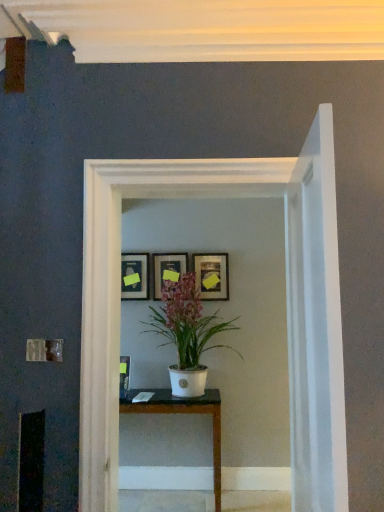
Question: Is matte gold picture frame at center, acting as the third picture frame starting from the left, wider or thinner than white glossy table at center?

Choices:
 (A) wide
 (B) thin

Answer: (B)

Question: From a real-world perspective, relative to white glossy table at center, is matte gold picture frame at center, the first picture frame viewed from the right, vertically above or below?

Choices:
 (A) below
 (B) above

Answer: (B)

Question: Which is farther from the matte black picture frame at upper center, positioned as the first picture frame in left-to-right order?

Choices:
 (A) white glossy table at center
 (B) matte black picture frame at center, the second picture frame in the left-to-right sequence
 (C) matte gold picture frame at center, acting as the third picture frame starting from the left
 (D) white glossy pot at center
 (E) white glossy glass door at center

Answer: (E)

Question: Considering the real-world distances, which object is farthest from the matte black picture frame at center, which is counted as the 2th picture frame, starting from the right?

Choices:
 (A) matte gold picture frame at center, acting as the third picture frame starting from the left
 (B) matte black picture frame at upper center, positioned as the first picture frame in left-to-right order
 (C) white glossy pot at center
 (D) white glossy table at center
 (E) white glossy glass door at center

Answer: (E)